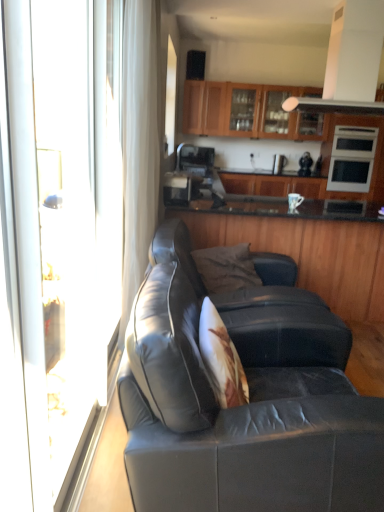
Question: Is wooden cabinets at upper center, the third cabinetry ordered from the bottom, in front of or behind matte black leather couch at center in the image?

Choices:
 (A) behind
 (B) front

Answer: (A)

Question: Which is correct: wooden cabinets at upper center, the first cabinetry in the top-to-bottom sequence, is inside matte black leather couch at center, or outside of it?

Choices:
 (A) inside
 (B) outside

Answer: (B)

Question: Considering the real-world distances, which object is closest to the satin black coffee machine at center, positioned as the 4th appliance in back-to-front order?

Choices:
 (A) satin silver microwave at upper right, which ranks as the first appliance in right-to-left order
 (B) satin black toaster at center, arranged as the third appliance when viewed from the front
 (C) transparent glass screen door at left
 (D) matte brown cabinets at center, which is counted as the 2th cabinetry, starting from the bottom
 (E) wooden cabinets at upper center, the third cabinetry ordered from the bottom

Answer: (B)

Question: Based on their relative distances, which object is farther from the matte brown cabinets at center, marked as the 2th cabinetry in a top-to-bottom arrangement?

Choices:
 (A) satin black coffee machine at center, positioned as the 4th appliance in back-to-front order
 (B) satin black toaster at center, marked as the second appliance in a back-to-front arrangement
 (C) satin silver microwave at upper right, which ranks as the fourth appliance in left-to-right order
 (D) dark gray fabric pillow at center
 (E) metallic silver coffee maker at center, which is counted as the fourth appliance, starting from the front

Answer: (D)